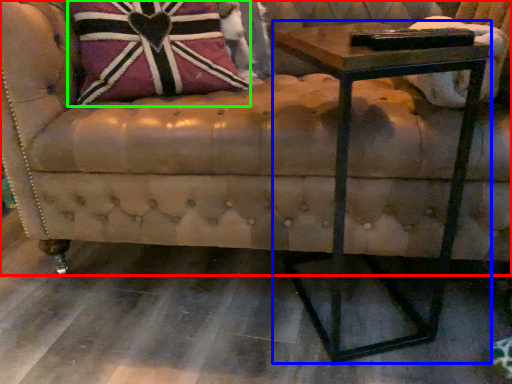
Question: Estimate the real-world distances between objects in this image. Which object is closer to studio couch (highlighted by a red box), table (highlighted by a blue box) or throw pillow (highlighted by a green box)?

Choices:
 (A) table
 (B) throw pillow

Answer: (A)